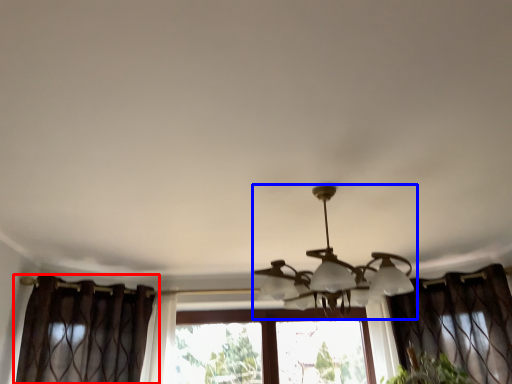
Question: Which point is closer to the camera, curtain (highlighted by a red box) or lamp (highlighted by a blue box)?

Choices:
 (A) curtain
 (B) lamp

Answer: (B)